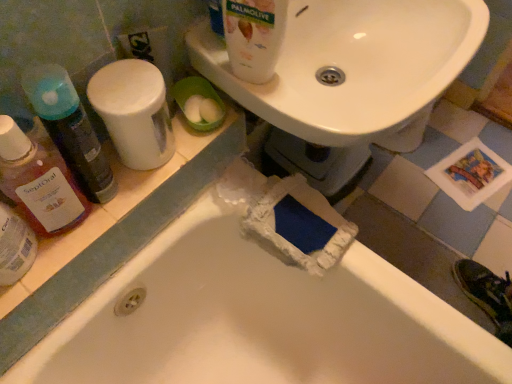
Question: Is white plastic container at upper left, which ranks as the third cleaning product in left-to-right order, positioned behind translucent plastic mouthwash at left?

Choices:
 (A) yes
 (B) no

Answer: (A)

Question: Does white plastic container at upper left, which ranks as the third cleaning product in left-to-right order, have a smaller size compared to translucent plastic mouthwash at left?

Choices:
 (A) yes
 (B) no

Answer: (B)

Question: Considering the relative positions of white plastic container at upper left, which ranks as the third cleaning product in left-to-right order, and translucent plastic mouthwash at left in the image provided, is white plastic container at upper left, which ranks as the third cleaning product in left-to-right order, to the right of translucent plastic mouthwash at left from the viewer's perspective?

Choices:
 (A) no
 (B) yes

Answer: (B)

Question: Is translucent plastic mouthwash at left inside white plastic container at upper left, which appears as the second cleaning product when viewed from the right?

Choices:
 (A) yes
 (B) no

Answer: (B)

Question: Is white plastic container at upper left, which ranks as the third cleaning product in left-to-right order, outside translucent plastic mouthwash at left?

Choices:
 (A) yes
 (B) no

Answer: (A)

Question: Is the position of white plastic container at upper left, which ranks as the third cleaning product in left-to-right order, less distant than that of translucent plastic mouthwash at left?

Choices:
 (A) no
 (B) yes

Answer: (A)

Question: Is translucent plastic bottle at left, marked as the second cleaning product in a left-to-right arrangement, smaller than translucent plastic mouthwash at left?

Choices:
 (A) no
 (B) yes

Answer: (A)

Question: Considering the relative sizes of translucent plastic bottle at left, which ranks as the 3th cleaning product in right-to-left order, and translucent plastic mouthwash at left in the image provided, is translucent plastic bottle at left, which ranks as the 3th cleaning product in right-to-left order, taller than translucent plastic mouthwash at left?

Choices:
 (A) no
 (B) yes

Answer: (B)

Question: Is translucent plastic bottle at left, which ranks as the 3th cleaning product in right-to-left order, further to the viewer compared to translucent plastic mouthwash at left?

Choices:
 (A) no
 (B) yes

Answer: (B)

Question: Considering the relative sizes of translucent plastic bottle at left, which ranks as the 3th cleaning product in right-to-left order, and translucent plastic mouthwash at left in the image provided, is translucent plastic bottle at left, which ranks as the 3th cleaning product in right-to-left order, bigger than translucent plastic mouthwash at left?

Choices:
 (A) no
 (B) yes

Answer: (B)

Question: Does translucent plastic bottle at left, marked as the second cleaning product in a left-to-right arrangement, have a lesser height compared to translucent plastic mouthwash at left?

Choices:
 (A) no
 (B) yes

Answer: (A)

Question: Can translucent plastic mouthwash at left be found inside translucent plastic bottle at left, marked as the second cleaning product in a left-to-right arrangement?

Choices:
 (A) no
 (B) yes

Answer: (A)

Question: Is white glossy bottle at upper center, which is the 4th cleaning product in left-to-right order, touching white glossy sink at upper center?

Choices:
 (A) yes
 (B) no

Answer: (B)